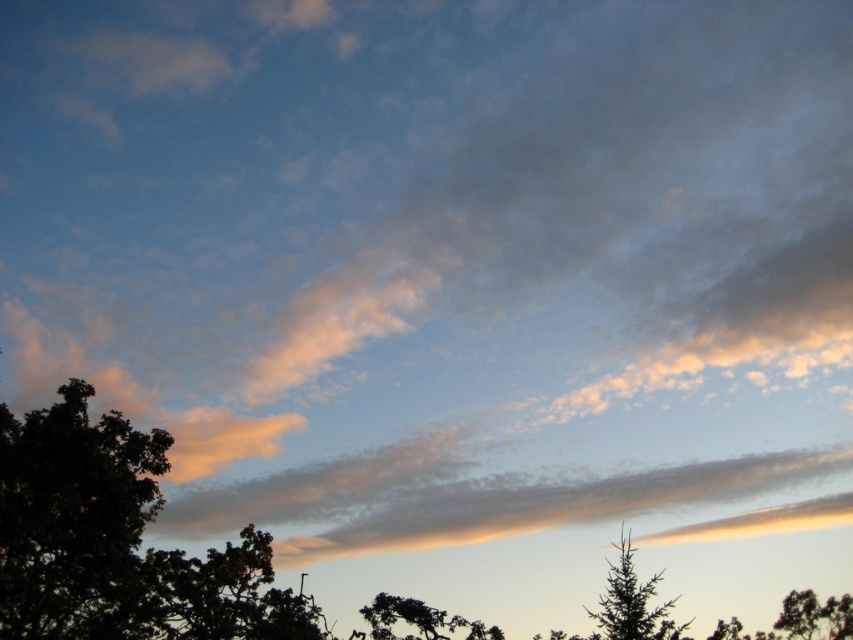
The width and height of the screenshot is (853, 640). I want to click on dark green leafy tree at lower left, so click(74, 520).

Which of these two, dark green leafy tree at lower left or green matte tree at lower right, stands taller?

Standing taller between the two is green matte tree at lower right.

Is point (28, 560) farther from camera compared to point (659, 616)?

Yes, it is.

The width and height of the screenshot is (853, 640). I want to click on dark green leafy tree at lower left, so click(74, 520).

Does green matte tree at lower right have a greater width compared to silhouette textured tree at lower center?

No.

Image resolution: width=853 pixels, height=640 pixels. In order to click on green matte tree at lower right in this screenshot , I will do `click(631, 602)`.

Based on the photo, who is shorter, dark green leafy tree at lower left or silhouette textured tree at lower center?

dark green leafy tree at lower left is shorter.

Between dark green leafy tree at lower left and silhouette textured tree at lower center, which one is positioned lower?

silhouette textured tree at lower center

Who is more distant from viewer, (32, 589) or (386, 595)?

Positioned behind is point (386, 595).

I want to click on dark green leafy tree at lower left, so click(74, 520).